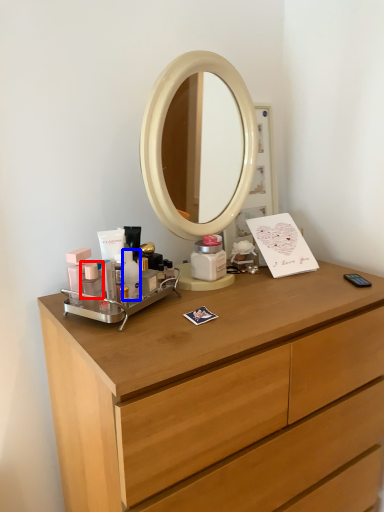
Question: Which object is closer to the camera taking this photo, toiletry (highlighted by a red box) or toiletry (highlighted by a blue box)?

Choices:
 (A) toiletry
 (B) toiletry

Answer: (A)